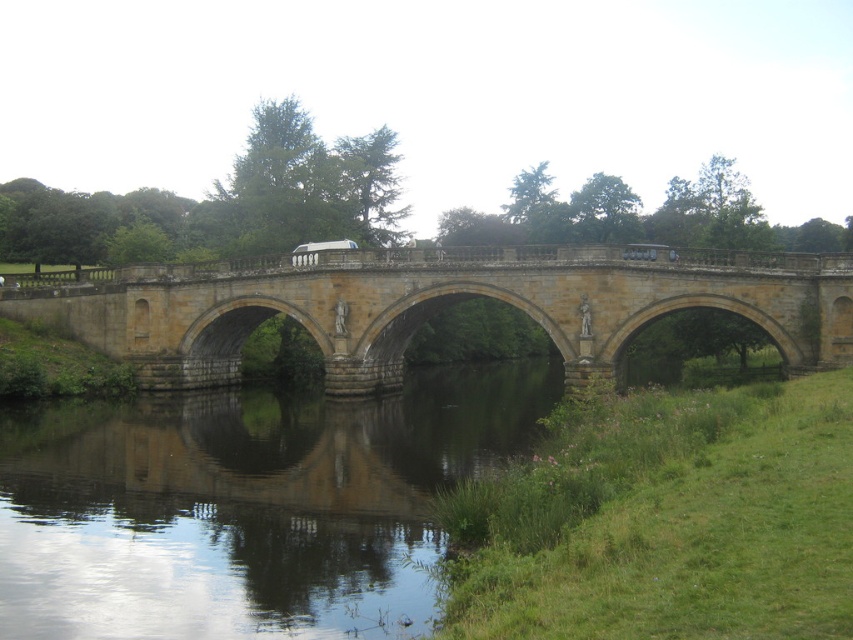
You are a photographer planning to capture the stone bridge at center and its reflection on the smooth reflective water at center. Based on the scene description, which one takes up more space in the image?

The stone bridge at center takes up more space in the image because the smooth reflective water at center occupies less space than it.

You are a photographer planning to capture the stone bridge at center and its reflection in the smooth reflective water at center. Can the water accommodate the entire width of the bridge for a perfect reflection?

The smooth reflective water at center has a width less than the stone bridge at center, so it cannot fully accommodate the entire width of the bridge for a perfect reflection.

You are a photographer trying to capture the stone bridge at center and its reflection in the smooth reflective water at center. Based on the scene, can you determine if the reflection will be fully visible in the water?

The smooth reflective water at center is shorter than the stone bridge at center, so the reflection of the stone bridge at center will not be fully visible in the water.